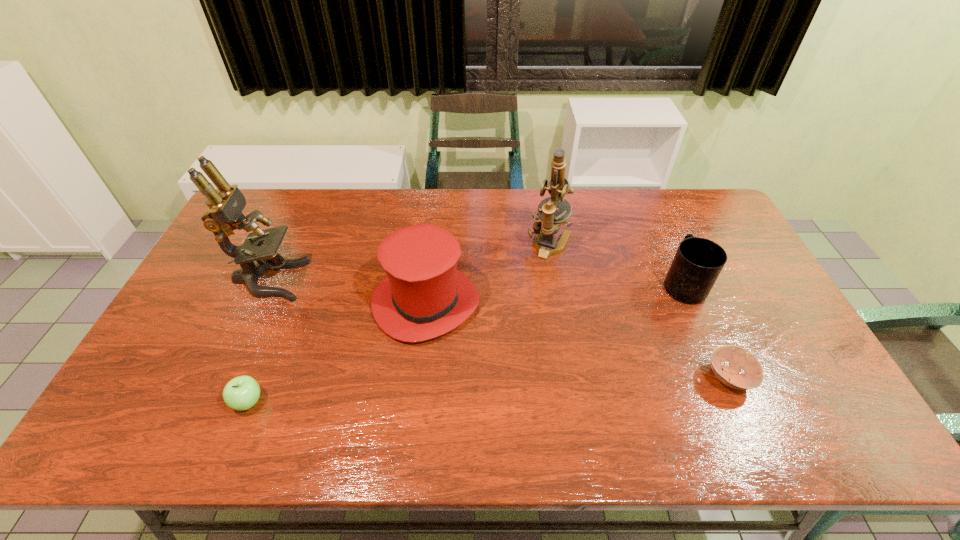
Image resolution: width=960 pixels, height=540 pixels. Identify the location of the left microscope. point(224,215).

You are a GUI agent. You are given a task and a screenshot of the screen. Output one action in this format:
    pyautogui.click(x=<x>, y=<y>)
    Task: Click on the fourth object from left to right
    The image size is (960, 540).
    Given the screenshot: What is the action you would take?
    pyautogui.click(x=546, y=224)

Where is `the fourth object from right to left`? The height and width of the screenshot is (540, 960). the fourth object from right to left is located at coordinates (424, 296).

Identify the location of the fourth shortest object. (424, 296).

At what (x,y) coordinates should I click in order to perform the action: click on the fourth tallest object. Please return your answer as a coordinate pair (x, y). Image resolution: width=960 pixels, height=540 pixels. Looking at the image, I should click on (698, 262).

Locate an element on the screen. apple is located at coordinates (241, 393).

Where is `the shortest object`? This screenshot has width=960, height=540. the shortest object is located at coordinates [738, 359].

Identify the location of vacant space situated at the eyepieces of the left microscope. (330, 280).

Where is `vacant space located 0.200m on the back of the fourth object from left to right`? vacant space located 0.200m on the back of the fourth object from left to right is located at coordinates (540, 194).

Where is `vacant area situated 0.270m on the left of the fourth object from right to left`? vacant area situated 0.270m on the left of the fourth object from right to left is located at coordinates (279, 302).